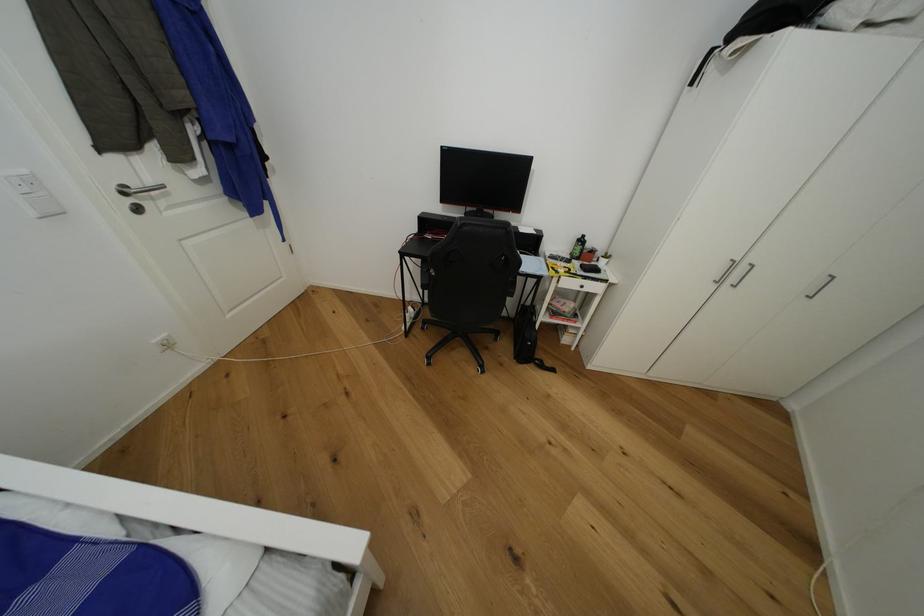
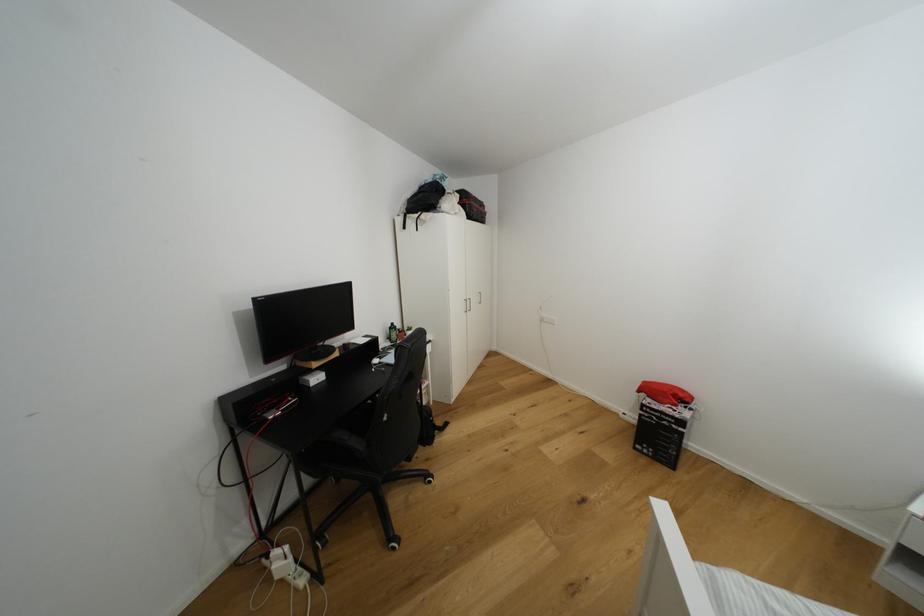
In the second image, find the point that corresponds to point (584, 241) in the first image.

(395, 330)